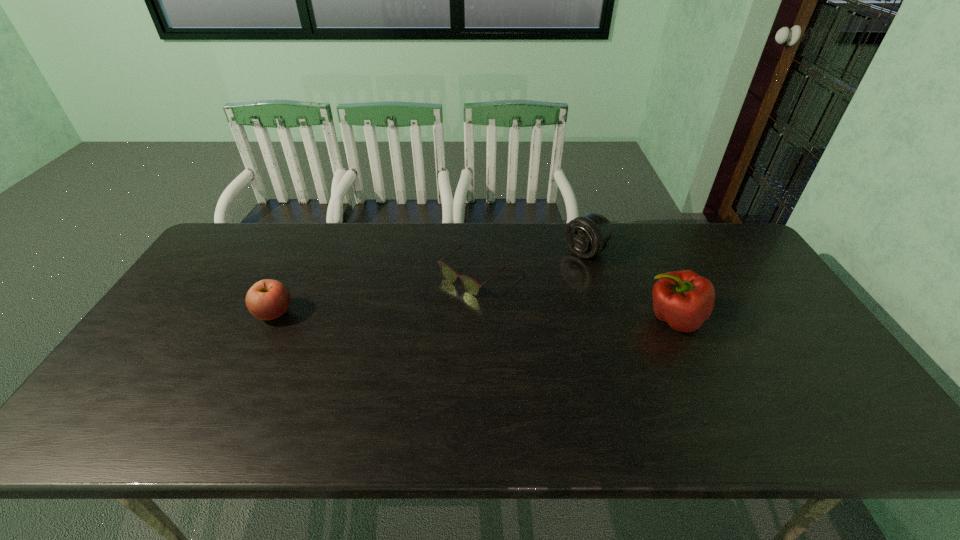
In order to click on vacant position located 0.060m on the front-facing side of the telephoto lens in this screenshot , I will do `click(559, 269)`.

Locate an element on the screen. The image size is (960, 540). vacant area situated 0.210m at the front view of the shortest object is located at coordinates (397, 335).

Find the location of a particular element. Image resolution: width=960 pixels, height=540 pixels. free space located 0.050m at the front view of the shortest object is located at coordinates (439, 303).

You are a GUI agent. You are given a task and a screenshot of the screen. Output one action in this format:
    pyautogui.click(x=<x>, y=<y>)
    Task: Click on the blank area located 0.230m at the front view of the shortest object
    
    Given the screenshot: What is the action you would take?
    pyautogui.click(x=392, y=340)

Locate an element on the screen. This screenshot has width=960, height=540. telephoto lens that is at the far edge is located at coordinates (587, 235).

Identify the location of spectacles that is at the far edge. (471, 286).

You are a GUI agent. You are given a task and a screenshot of the screen. Output one action in this format:
    pyautogui.click(x=<x>, y=<y>)
    Task: Click on the vacant space at the far edge of the desktop
    
    Given the screenshot: What is the action you would take?
    pyautogui.click(x=299, y=246)

In the image, there is a desktop. Where is `vacant space at the near edge`? The image size is (960, 540). vacant space at the near edge is located at coordinates (641, 383).

This screenshot has height=540, width=960. Identify the location of free location at the left edge of the desktop. (184, 295).

The width and height of the screenshot is (960, 540). I want to click on vacant space at the right edge of the desktop, so click(x=744, y=266).